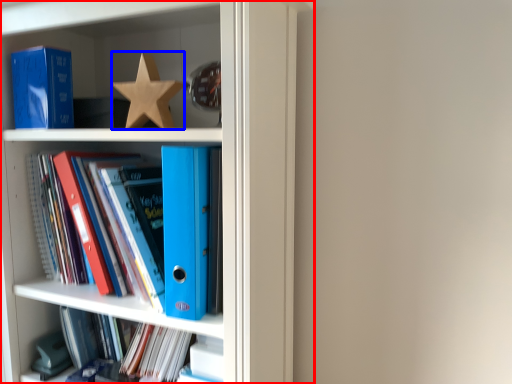
Question: Which object appears closest to the camera in this image, bookcase (highlighted by a red box) or star (highlighted by a blue box)?

Choices:
 (A) bookcase
 (B) star

Answer: (A)